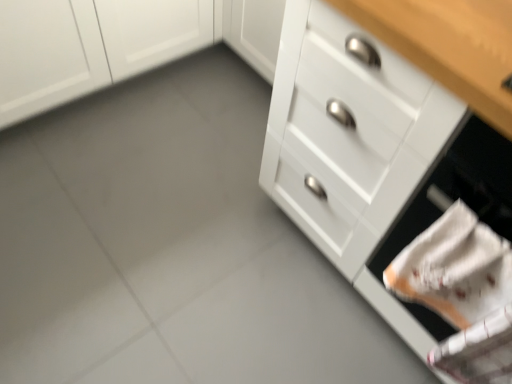
Question: Is white glossy drawer at right thinner than white matte drawer at lower right?

Choices:
 (A) no
 (B) yes

Answer: (B)

Question: From the image's perspective, is white glossy drawer at right located above white matte drawer at lower right?

Choices:
 (A) no
 (B) yes

Answer: (B)

Question: Is white glossy drawer at right surrounding white matte drawer at lower right?

Choices:
 (A) no
 (B) yes

Answer: (B)

Question: Is white glossy drawer at right in front of white matte drawer at lower right?

Choices:
 (A) yes
 (B) no

Answer: (B)

Question: Can we say white glossy drawer at right lies outside white matte drawer at lower right?

Choices:
 (A) yes
 (B) no

Answer: (B)

Question: Which is correct: white glossy drawer at right is inside white matte drawer at lower right, or outside of it?

Choices:
 (A) outside
 (B) inside

Answer: (B)

Question: Does point (328, 135) appear closer or farther from the camera than point (446, 165)?

Choices:
 (A) closer
 (B) farther

Answer: (B)

Question: From a real-world perspective, relative to white matte drawer at lower right, is white glossy drawer at right vertically above or below?

Choices:
 (A) below
 (B) above

Answer: (A)

Question: Based on their sizes in the image, would you say white glossy drawer at right is bigger or smaller than white matte drawer at lower right?

Choices:
 (A) small
 (B) big

Answer: (B)

Question: Considering the positions of white matte drawer at lower right and white glossy drawer at right in the image, is white matte drawer at lower right wider or thinner than white glossy drawer at right?

Choices:
 (A) wide
 (B) thin

Answer: (A)

Question: Considering the positions of white matte drawer at lower right and white glossy drawer at right in the image, is white matte drawer at lower right taller or shorter than white glossy drawer at right?

Choices:
 (A) tall
 (B) short

Answer: (B)

Question: From a real-world perspective, is white matte drawer at lower right above or below white glossy drawer at right?

Choices:
 (A) below
 (B) above

Answer: (B)

Question: Visually, is white matte drawer at lower right positioned to the left or to the right of white glossy drawer at right?

Choices:
 (A) left
 (B) right

Answer: (B)

Question: In terms of size, does white matte cabinet at upper left appear bigger or smaller than white matte drawer at lower right?

Choices:
 (A) big
 (B) small

Answer: (A)

Question: Is white matte cabinet at upper left taller or shorter than white matte drawer at lower right?

Choices:
 (A) tall
 (B) short

Answer: (B)